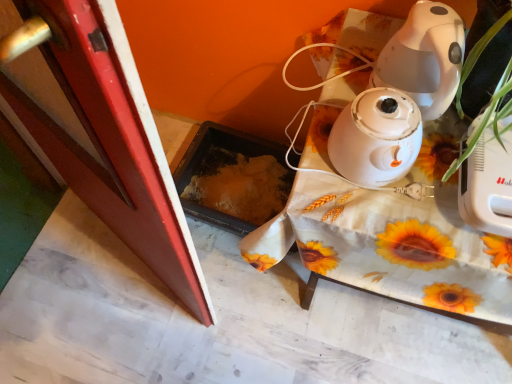
This screenshot has width=512, height=384. I want to click on vacant region below green leafy plant at right (from a real-world perspective), so click(440, 149).